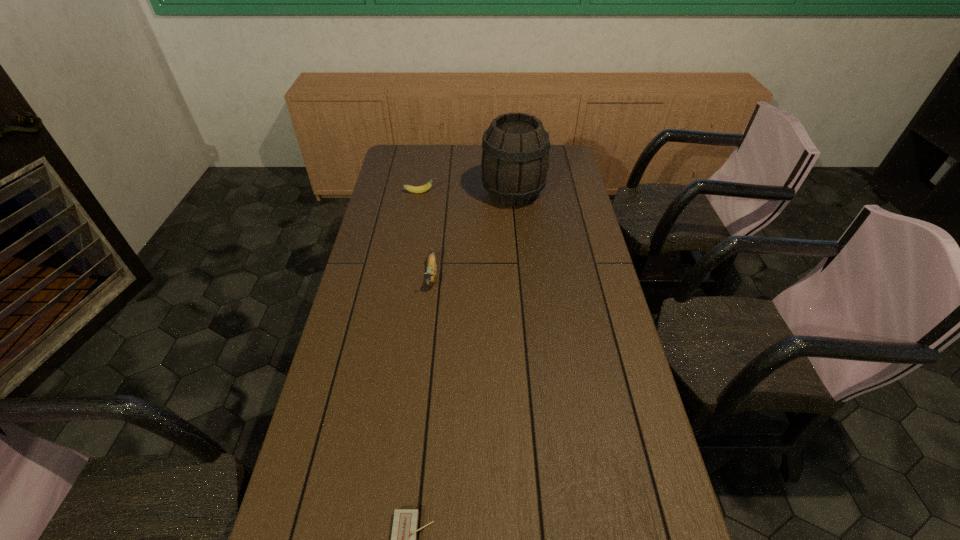
Locate an element on the screen. The width and height of the screenshot is (960, 540). free space in the image that satisfies the following two spatial constraints: 1. at the stem of the wine bucket; 2. on the right side of the third tallest object is located at coordinates (420, 193).